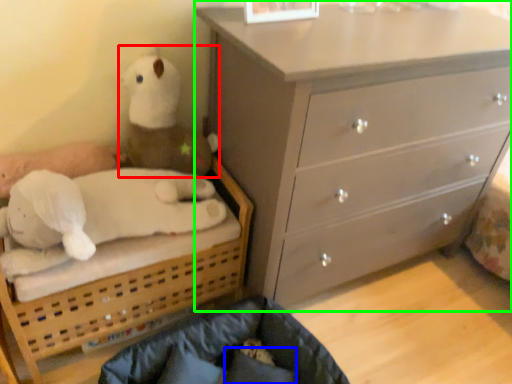
Question: Based on their relative distances, which object is farther from toy (highlighted by a red box)? Choose from pillow (highlighted by a blue box) and chest of drawers (highlighted by a green box).

Choices:
 (A) pillow
 (B) chest of drawers

Answer: (A)